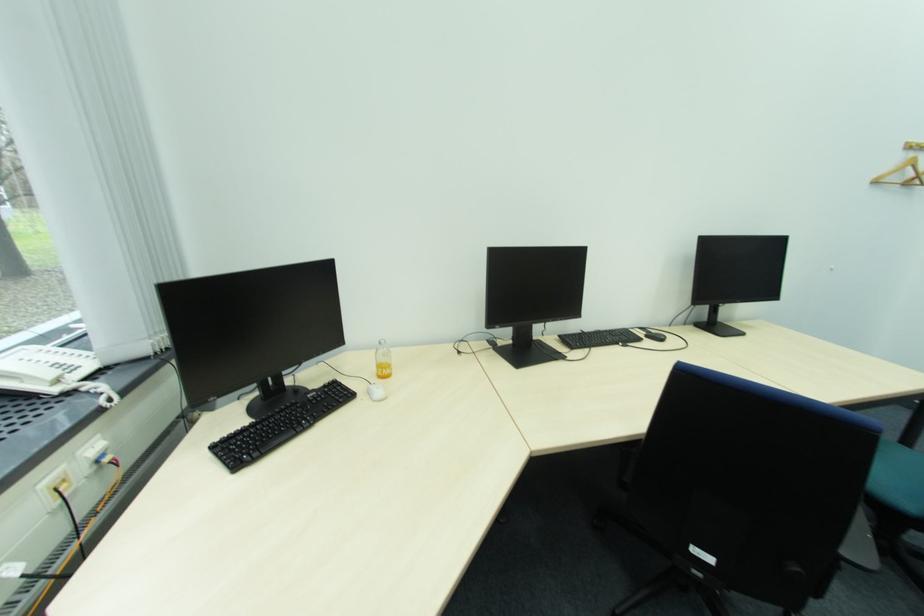
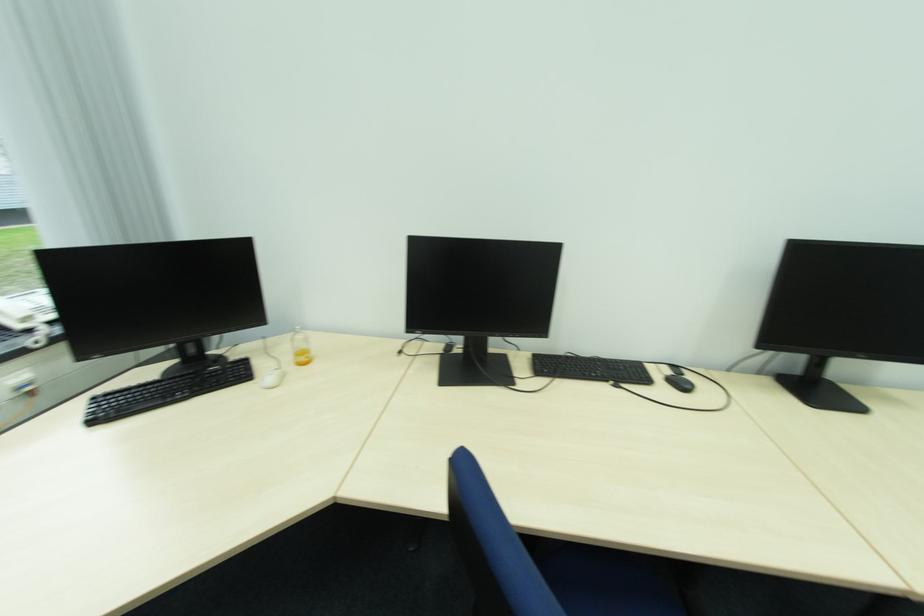
Where in the second image is the point corresponding to pixel 66 381 from the first image?

(31, 320)